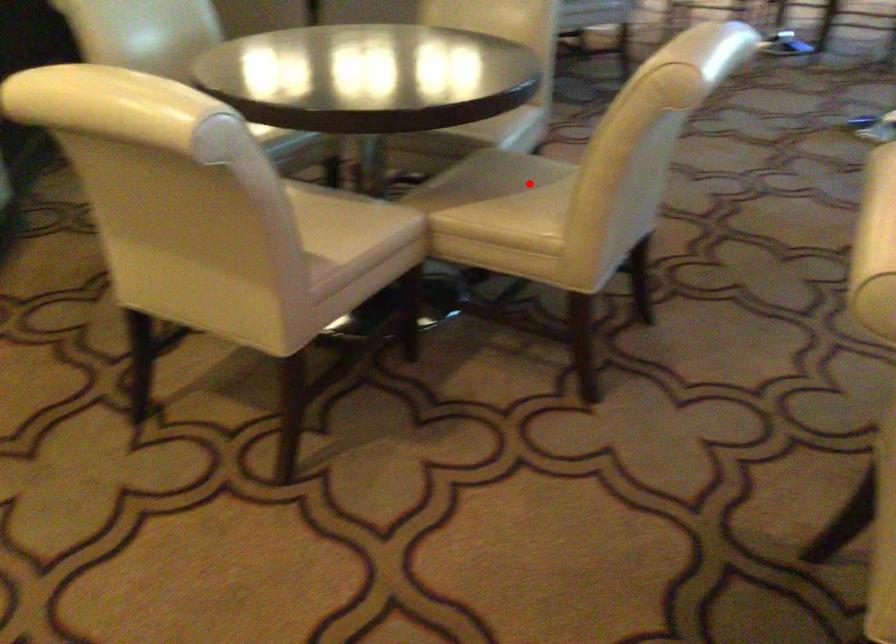
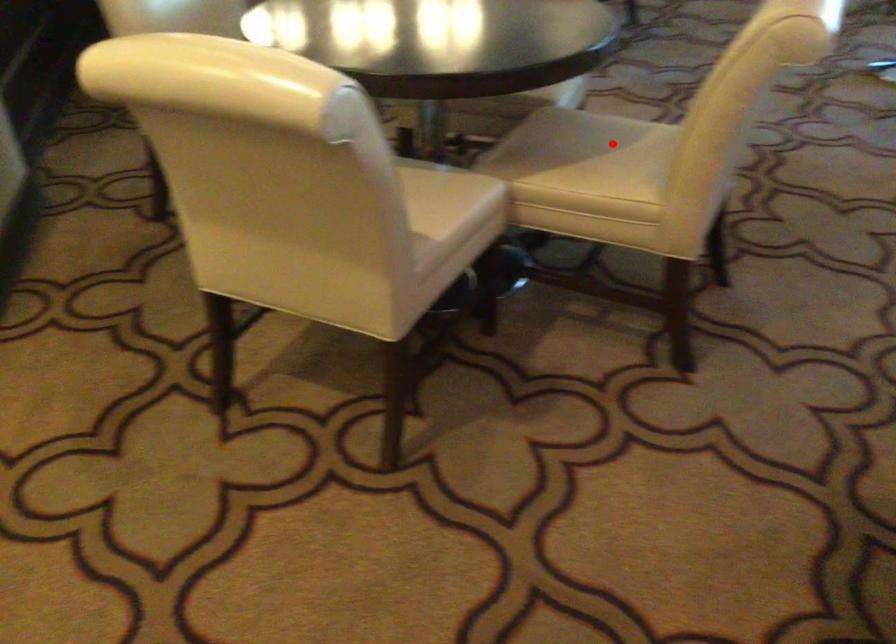
I am providing you with two images of the same scene from different viewpoints. A red point is marked on the first image and another point is marked on the second image. Do the highlighted points in image1 and image2 indicate the same real-world spot?

Yes